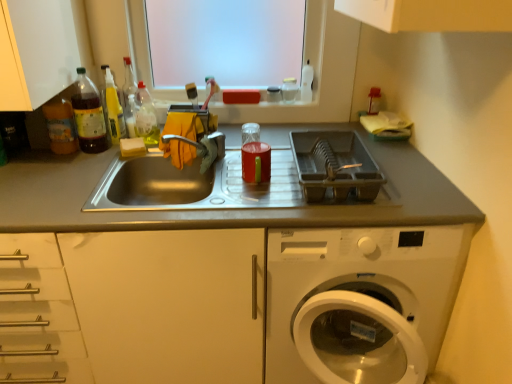
Question: Is translucent plastic bottle at upper left, which appears as the fourth bottle when viewed from the left, looking in the opposite direction of translucent plastic bottle at left, which is the third bottle from right to left?

Choices:
 (A) yes
 (B) no

Answer: (B)

Question: Would you say translucent plastic bottle at left, marked as the second bottle in a left-to-right arrangement, is part of translucent plastic bottle at upper left, which appears as the fourth bottle when viewed from the left,'s contents?

Choices:
 (A) no
 (B) yes

Answer: (A)

Question: Is translucent plastic bottle at upper left, which appears as the fourth bottle when viewed from the left, taller than translucent plastic bottle at left, which is the third bottle from right to left?

Choices:
 (A) no
 (B) yes

Answer: (A)

Question: From a real-world perspective, is translucent plastic bottle at upper left, which appears as the fourth bottle when viewed from the left, under translucent plastic bottle at left, marked as the second bottle in a left-to-right arrangement?

Choices:
 (A) no
 (B) yes

Answer: (B)

Question: Is translucent plastic bottle at upper left, which ranks as the 1th bottle in right-to-left order, further to the viewer compared to translucent plastic bottle at left, marked as the second bottle in a left-to-right arrangement?

Choices:
 (A) no
 (B) yes

Answer: (B)

Question: From a real-world perspective, is translucent plastic bottle at upper left, which ranks as the 1th bottle in right-to-left order, positioned over translucent plastic bottle at left, marked as the second bottle in a left-to-right arrangement, based on gravity?

Choices:
 (A) no
 (B) yes

Answer: (A)

Question: Is translucent plastic bottle at left, marked as the second bottle in a left-to-right arrangement, aimed at white sponge at sink left?

Choices:
 (A) yes
 (B) no

Answer: (B)

Question: Is translucent plastic bottle at left, marked as the second bottle in a left-to-right arrangement, shorter than white sponge at sink left?

Choices:
 (A) no
 (B) yes

Answer: (A)

Question: Does translucent plastic bottle at left, which is the third bottle from right to left, touch white sponge at sink left?

Choices:
 (A) yes
 (B) no

Answer: (B)

Question: Is translucent plastic bottle at left, which is the third bottle from right to left, bigger than white sponge at sink left?

Choices:
 (A) no
 (B) yes

Answer: (B)

Question: Does translucent plastic bottle at left, which is the third bottle from right to left, come behind white sponge at sink left?

Choices:
 (A) yes
 (B) no

Answer: (B)

Question: Is white sponge at sink left surrounded by translucent plastic bottle at left, which is the third bottle from right to left?

Choices:
 (A) yes
 (B) no

Answer: (B)

Question: From the image's perspective, does plastic dish rack at right appear lower than translucent plastic bottle at upper left, which appears as the fourth bottle when viewed from the left?

Choices:
 (A) no
 (B) yes

Answer: (B)